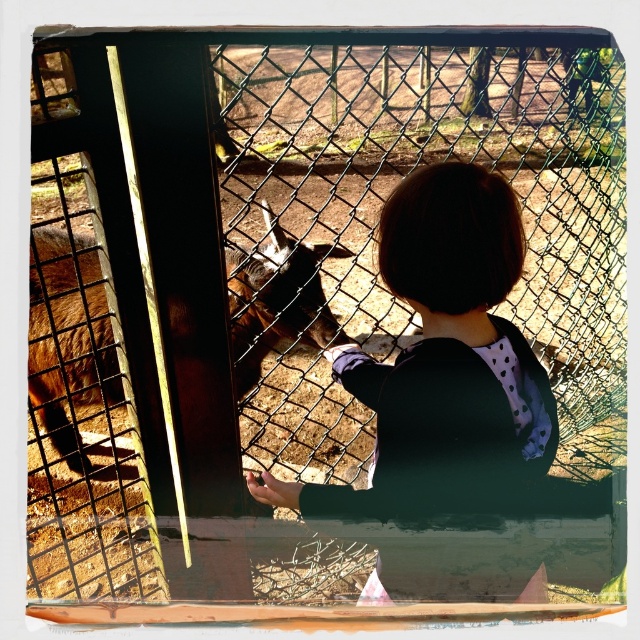
You are a zookeeper trying to locate the child in the enclosure area. The coordinate system has the origin at the bottom left corner. Where is the black matte shirt at center located?

The black matte shirt at center is located at coordinates point (442, 356).

You are a zookeeper who needs to ensure that the black matte shirt at center and the brown furry goat at left are visible to visitors. Based on their heights, which one might need a platform to be seen better?

The black matte shirt at center is not as tall as the brown furry goat at left, so the child wearing the black matte shirt at center might need a platform to be seen better by visitors.

Based on the scene description, if the child wants to touch the brown furry goat at left, which direction should they move their hand from the black matte shirt at center?

The black matte shirt at center is below the brown furry goat at left, so the child should move their hand upward from the black matte shirt at center to reach the brown furry goat at left.